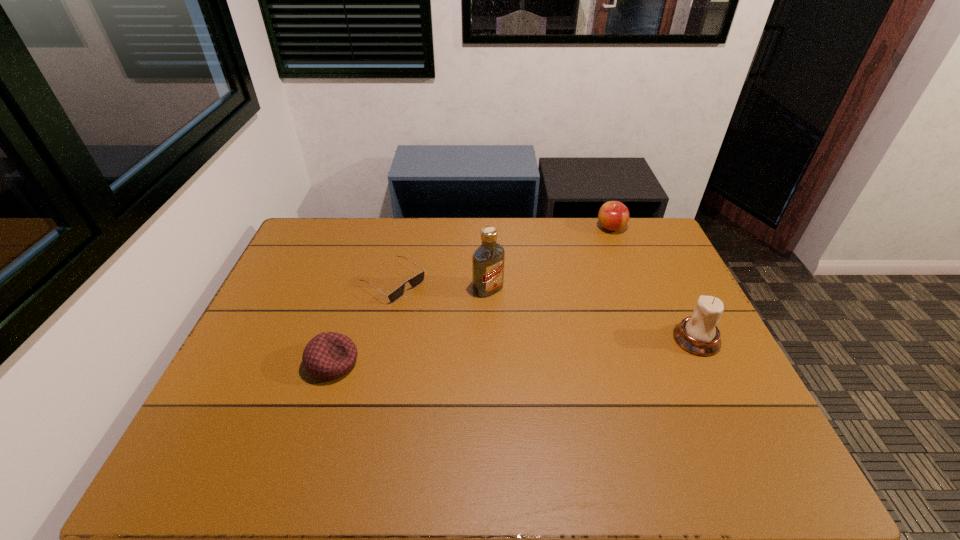
Locate an element on the screen. The width and height of the screenshot is (960, 540). vacant area between the third shortest object and the fourth tallest object is located at coordinates (472, 295).

Find the location of a particular element. vacant space in between the second tallest object and the farthest object is located at coordinates (654, 284).

Image resolution: width=960 pixels, height=540 pixels. I want to click on vacant space that is in between the fourth tallest object and the third object from right to left, so click(x=411, y=326).

In order to click on vacant area that lies between the beanbag and the shortest object in this screenshot , I will do `click(363, 323)`.

The width and height of the screenshot is (960, 540). Identify the location of free point between the second tallest object and the beanbag. (515, 351).

Where is `vacant area between the second shortest object and the shortest object`? The width and height of the screenshot is (960, 540). vacant area between the second shortest object and the shortest object is located at coordinates click(x=363, y=323).

Locate an element on the screen. The image size is (960, 540). free area in between the shortest object and the candle holder is located at coordinates (544, 310).

Choose which object is the fourth nearest neighbor to the vodka. Please provide its 2D coordinates. Your answer should be formatted as a tuple, i.e. [(x, y)], where the tuple contains the x and y coordinates of a point satisfying the conditions above.

[(698, 334)]

Locate which object ranks third in proximity to the second shortest object. Please provide its 2D coordinates. Your answer should be formatted as a tuple, i.e. [(x, y)], where the tuple contains the x and y coordinates of a point satisfying the conditions above.

[(698, 334)]

Find the location of a particular element. The image size is (960, 540). vacant space that satisfies the following two spatial constraints: 1. on the back side of the fourth tallest object; 2. on the left side of the tallest object is located at coordinates (356, 289).